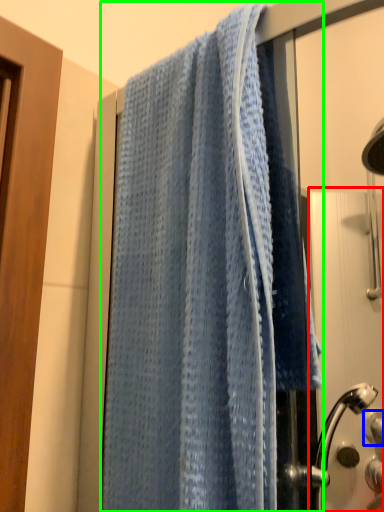
Question: Which object is positioned farthest from screen door (highlighted by a red box)? Select from knob (highlighted by a blue box) and towel (highlighted by a green box).

Choices:
 (A) knob
 (B) towel

Answer: (B)